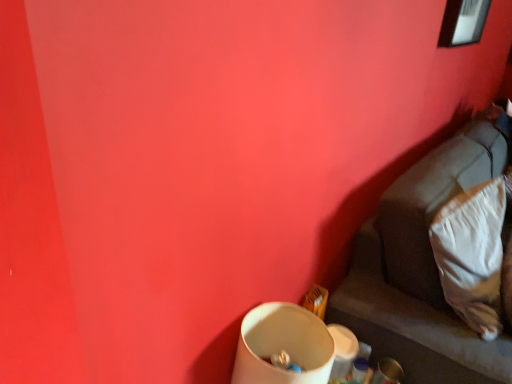
The width and height of the screenshot is (512, 384). What do you see at coordinates (422, 269) in the screenshot? I see `suede-like beige couch at lower right` at bounding box center [422, 269].

Where is `suede-like beige couch at lower right`? suede-like beige couch at lower right is located at coordinates point(422,269).

What do you see at coordinates (472, 254) in the screenshot? I see `white soft pillow at lower right` at bounding box center [472, 254].

The image size is (512, 384). I want to click on white soft pillow at lower right, so click(472, 254).

Find the location of a particular element. suede-like beige couch at lower right is located at coordinates (422, 269).

Considering the relative positions of suede-like beige couch at lower right and white soft pillow at lower right in the image provided, is suede-like beige couch at lower right to the left of white soft pillow at lower right from the viewer's perspective?

No.

From the picture: Is suede-like beige couch at lower right positioned behind white soft pillow at lower right?

That is False.

Is point (408, 264) closer to viewer compared to point (471, 236)?

No, (408, 264) is behind (471, 236).

From the image's perspective, is suede-like beige couch at lower right located above or below white soft pillow at lower right?

suede-like beige couch at lower right is situated lower than white soft pillow at lower right in the image.

From a real-world perspective, is suede-like beige couch at lower right physically located above or below white soft pillow at lower right?

In terms of real-world spatial position, suede-like beige couch at lower right is below white soft pillow at lower right.

Is suede-like beige couch at lower right wider than white soft pillow at lower right?

Yes.

Between suede-like beige couch at lower right and white soft pillow at lower right, which one has less height?

white soft pillow at lower right.

Is suede-like beige couch at lower right smaller than white soft pillow at lower right?

No.

Is suede-like beige couch at lower right situated inside white soft pillow at lower right or outside?

suede-like beige couch at lower right is spatially situated outside white soft pillow at lower right.

Are suede-like beige couch at lower right and white soft pillow at lower right beside each other?

suede-like beige couch at lower right is not next to white soft pillow at lower right, and they're not touching.

Is suede-like beige couch at lower right aimed at white soft pillow at lower right?

Yes, suede-like beige couch at lower right is oriented towards white soft pillow at lower right.

How distant is suede-like beige couch at lower right from white soft pillow at lower right?

suede-like beige couch at lower right is 12.29 centimeters from white soft pillow at lower right.

Where is `furniture on the right of the white soft pillow at lower right`? The image size is (512, 384). furniture on the right of the white soft pillow at lower right is located at coordinates (422, 269).

Which is more to the left, white soft pillow at lower right or suede-like beige couch at lower right?

white soft pillow at lower right is more to the left.

Is white soft pillow at lower right further to camera compared to suede-like beige couch at lower right?

Yes, white soft pillow at lower right is further from the viewer.

Does point (447, 267) appear closer or farther from the camera than point (411, 344)?

Clearly, point (447, 267) is closer to the camera than point (411, 344).

From the image's perspective, would you say white soft pillow at lower right is shown under suede-like beige couch at lower right?

No, from the image's perspective, white soft pillow at lower right is not beneath suede-like beige couch at lower right.

From a real-world perspective, is white soft pillow at lower right located higher than suede-like beige couch at lower right?

Yes.

Considering the sizes of objects white soft pillow at lower right and suede-like beige couch at lower right in the image provided, who is thinner, white soft pillow at lower right or suede-like beige couch at lower right?

Thinner between the two is white soft pillow at lower right.

Considering the relative sizes of white soft pillow at lower right and suede-like beige couch at lower right in the image provided, is white soft pillow at lower right taller than suede-like beige couch at lower right?

In fact, white soft pillow at lower right may be shorter than suede-like beige couch at lower right.

Does white soft pillow at lower right have a larger size compared to suede-like beige couch at lower right?

Actually, white soft pillow at lower right might be smaller than suede-like beige couch at lower right.

Is white soft pillow at lower right not within suede-like beige couch at lower right?

No, white soft pillow at lower right is not entirely external to suede-like beige couch at lower right.

Does white soft pillow at lower right touch suede-like beige couch at lower right?

white soft pillow at lower right and suede-like beige couch at lower right are not in contact.

From the picture: Is white soft pillow at lower right facing towards suede-like beige couch at lower right?

Yes, white soft pillow at lower right is turned towards suede-like beige couch at lower right.

Find the location of a particular element. The width and height of the screenshot is (512, 384). furniture on the right side of white soft pillow at lower right is located at coordinates (422, 269).

The width and height of the screenshot is (512, 384). In order to click on pillow above the suede-like beige couch at lower right (from a real-world perspective) in this screenshot , I will do `click(472, 254)`.

What are the coordinates of `furniture on the right of white soft pillow at lower right` in the screenshot? It's located at (422, 269).